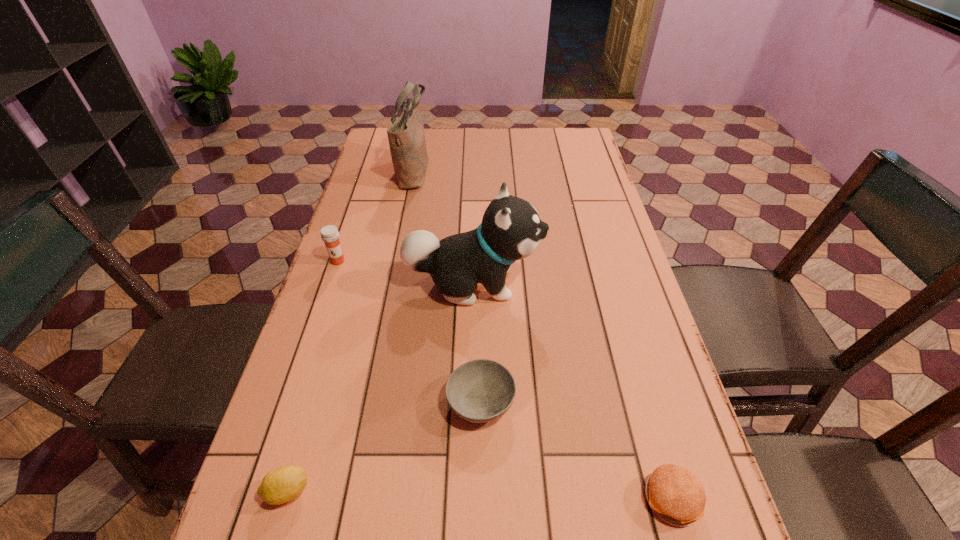
You are a GUI agent. You are given a task and a screenshot of the screen. Output one action in this format:
    pyautogui.click(x=<x>, y=<y>)
    Task: Click on the shoulder bag
    This screenshot has height=540, width=960.
    Given the screenshot: What is the action you would take?
    pyautogui.click(x=406, y=136)

Find the location of a particular element. puppy is located at coordinates (511, 229).

Where is `medicine`? The image size is (960, 540). medicine is located at coordinates (329, 234).

The image size is (960, 540). In order to click on lemon in this screenshot , I will do `click(283, 484)`.

This screenshot has width=960, height=540. Identify the location of hamburger. (676, 495).

At what (x,y) coordinates should I click in order to perform the action: click on bowl. Please return your answer as a coordinate pair (x, y). Looking at the image, I should click on (482, 390).

This screenshot has width=960, height=540. What are the coordinates of `free region located 0.330m on the front-facing side of the farthest object` in the screenshot? It's located at (528, 170).

Locate an element on the screen. The image size is (960, 540). blank area located at the face of the puppy is located at coordinates (x=636, y=284).

Identify the location of free space located on the label side of the medicine. (314, 333).

This screenshot has height=540, width=960. Identify the location of vacant region located 0.060m at the stem end of the lemon. (346, 491).